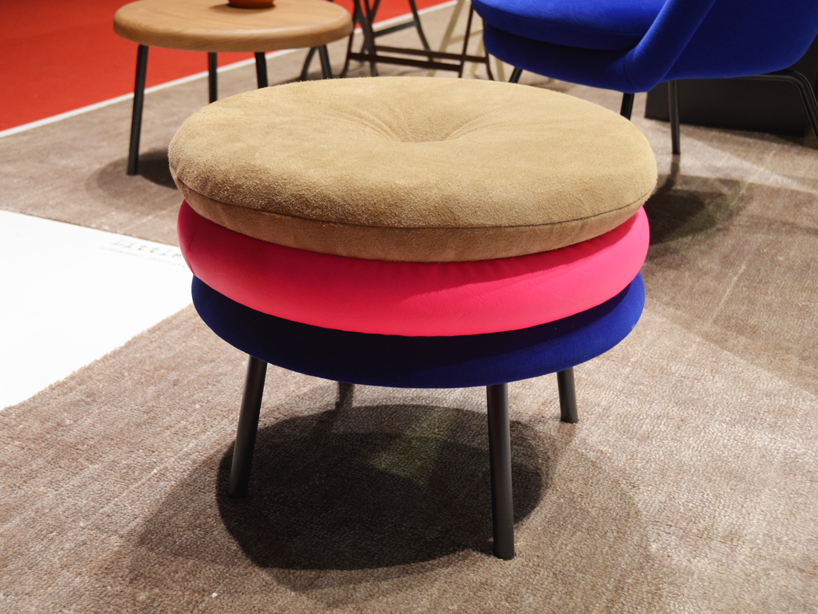
Where is `stool leg`? The image size is (818, 614). stool leg is located at coordinates (262, 74).